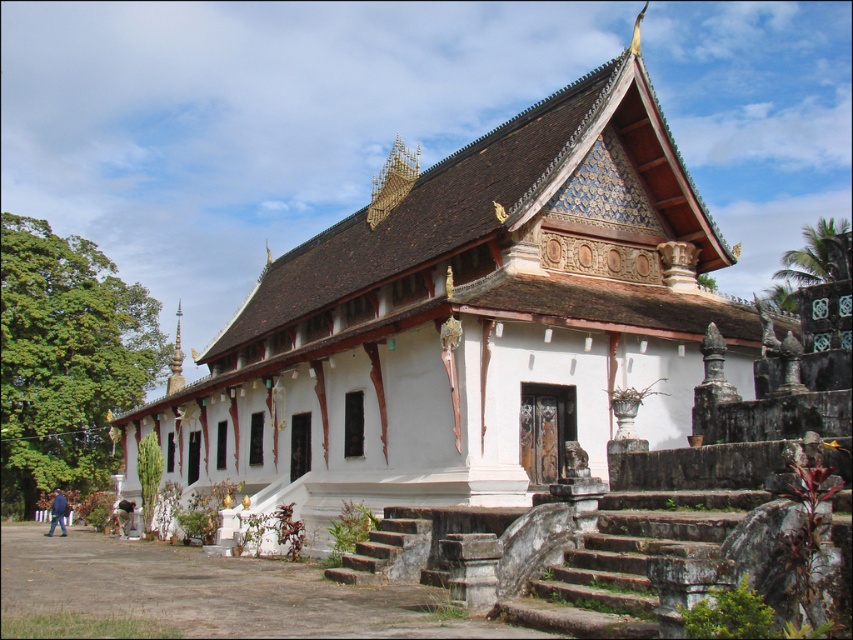
Is white painted wood palace at center thinner than gold/gilded stupa at left?

Incorrect, white painted wood palace at center's width is not less than gold/gilded stupa at left's.

Is white painted wood palace at center to the left of gold/gilded stupa at left from the viewer's perspective?

No, white painted wood palace at center is not to the left of gold/gilded stupa at left.

Who is more forward, (318, 506) or (178, 365)?

Positioned in front is point (318, 506).

Identify the location of white painted wood palace at center. This screenshot has height=640, width=853. (466, 320).